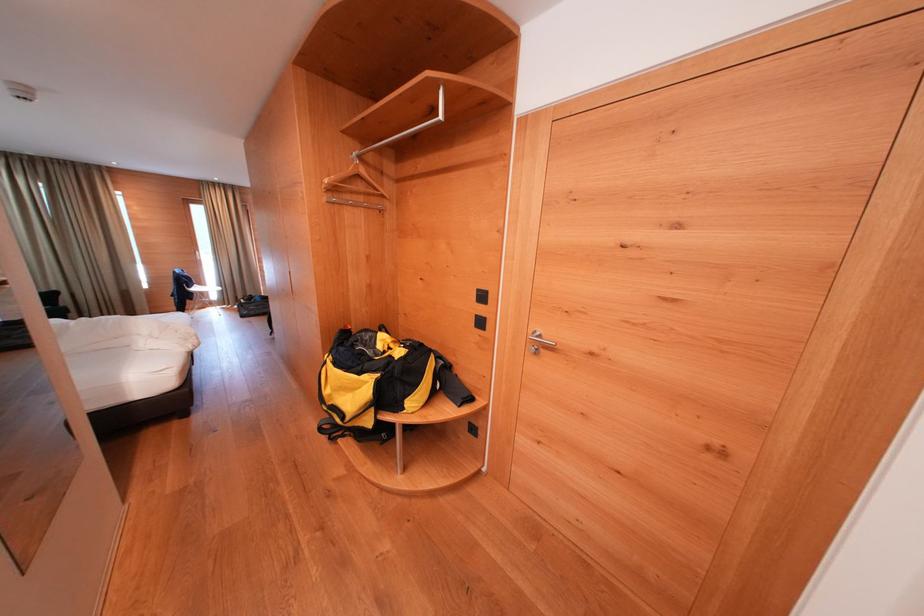
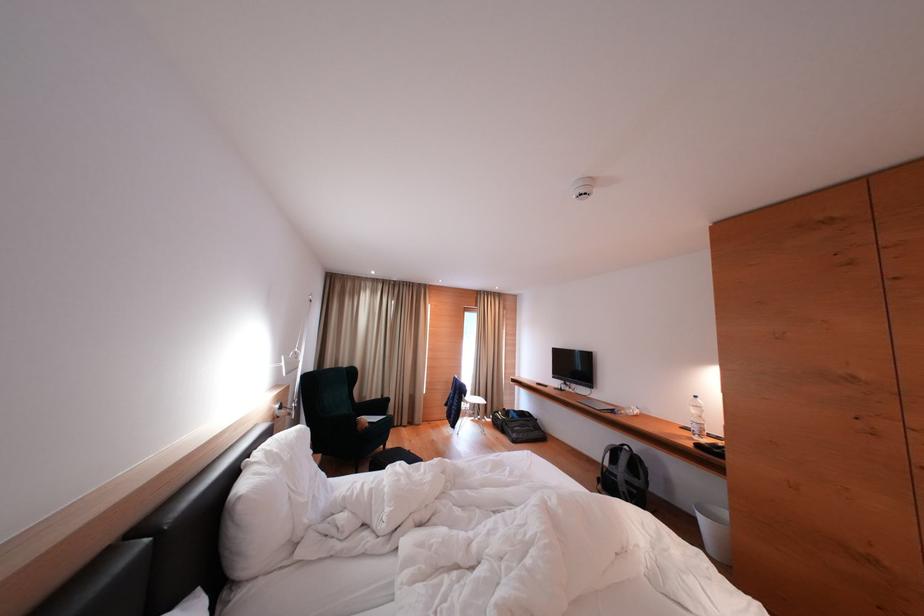
Find the pixel in the second image that matches point (215, 293) in the first image.

(477, 402)